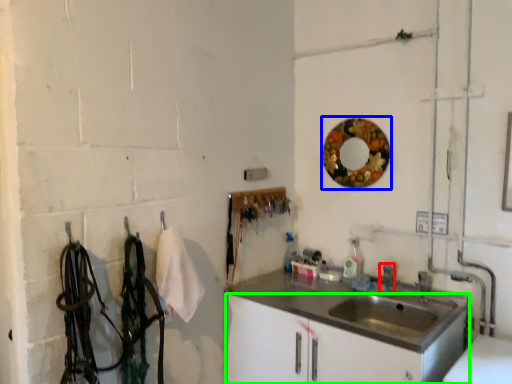
Question: Which is farther away from faucet (highlighted by a red box)? mirror (highlighted by a blue box) or bathroom cabinet (highlighted by a green box)?

Choices:
 (A) mirror
 (B) bathroom cabinet

Answer: (A)